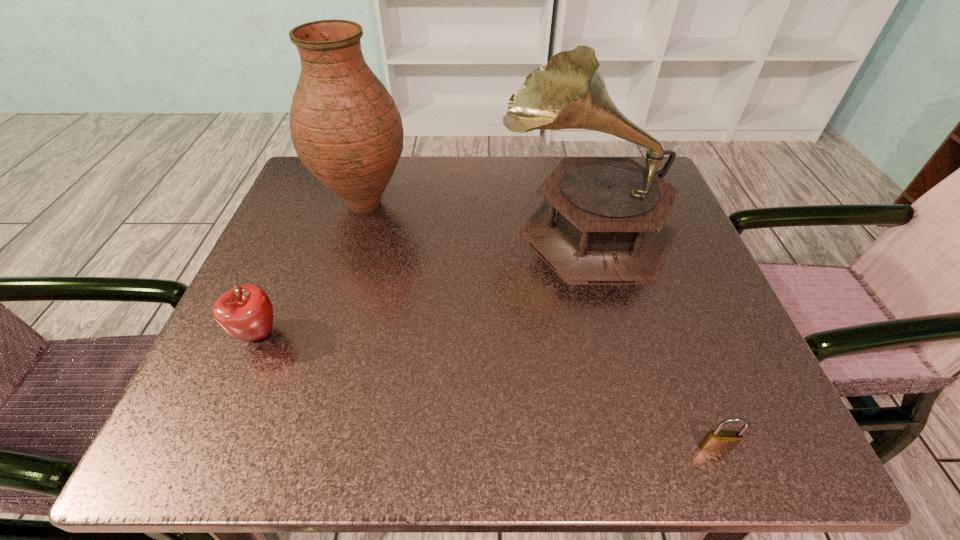
The image size is (960, 540). Identify the location of free space that is in between the phonograph record and the second nearest object. [x=422, y=280].

Identify the location of free area in between the apple and the phonograph record. Image resolution: width=960 pixels, height=540 pixels. (422, 280).

The height and width of the screenshot is (540, 960). I want to click on empty location between the padlock and the phonograph record, so click(651, 336).

Locate an element on the screen. The height and width of the screenshot is (540, 960). vacant point located between the second nearest object and the nearest object is located at coordinates (487, 391).

Locate an element on the screen. Image resolution: width=960 pixels, height=540 pixels. unoccupied area between the apple and the vase is located at coordinates (312, 269).

At what (x,y) coordinates should I click in order to perform the action: click on free space between the vase and the second shortest object. Please return your answer as a coordinate pair (x, y). The height and width of the screenshot is (540, 960). Looking at the image, I should click on (312, 269).

Where is `object that is the third closest one to the vase`? This screenshot has height=540, width=960. object that is the third closest one to the vase is located at coordinates (716, 441).

Identify which object is the second nearest to the padlock. Please provide its 2D coordinates. Your answer should be formatted as a tuple, i.e. [(x, y)], where the tuple contains the x and y coordinates of a point satisfying the conditions above.

[(345, 127)]

The width and height of the screenshot is (960, 540). In order to click on vacant space that satisfies the following two spatial constraints: 1. on the horn direction of the nearest object; 2. on the left side of the phonograph record in this screenshot , I will do `click(644, 448)`.

This screenshot has width=960, height=540. Find the location of `free space that satisfies the following two spatial constraints: 1. on the horn direction of the padlock; 2. on the left side of the phonograph record`. free space that satisfies the following two spatial constraints: 1. on the horn direction of the padlock; 2. on the left side of the phonograph record is located at coordinates (644, 448).